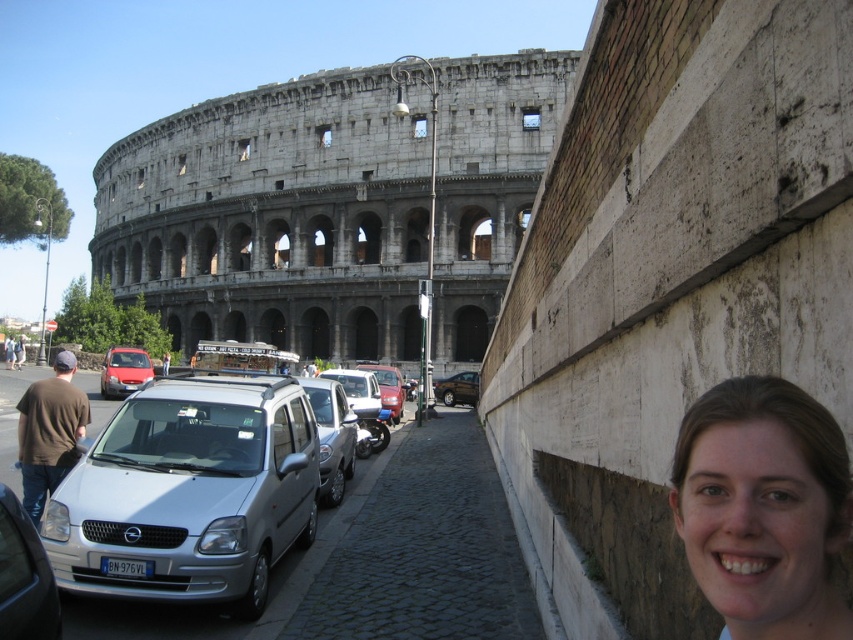
Question: Is silver metallic van at center wider than smooth skin face at lower right?

Choices:
 (A) yes
 (B) no

Answer: (A)

Question: In this image, where is smooth skin face at lower right located relative to matte red car at center?

Choices:
 (A) below
 (B) above

Answer: (A)

Question: Which of these objects is positioned closest to the silver metallic car at lower left?

Choices:
 (A) brown cotton shirt at left
 (B) silver metallic van at center
 (C) shiny brown car at center
 (D) matte red car at center

Answer: (B)

Question: Which point is farther to the camera?

Choices:
 (A) (129, 355)
 (B) (22, 448)
 (C) (448, 237)

Answer: (C)

Question: Is gray stone amphitheater at upper left further to the viewer compared to silver metallic van at center?

Choices:
 (A) no
 (B) yes

Answer: (B)

Question: Which point appears closest to the camera in this image?

Choices:
 (A) (3, 627)
 (B) (105, 353)
 (C) (476, 376)
 (D) (283, 528)

Answer: (A)